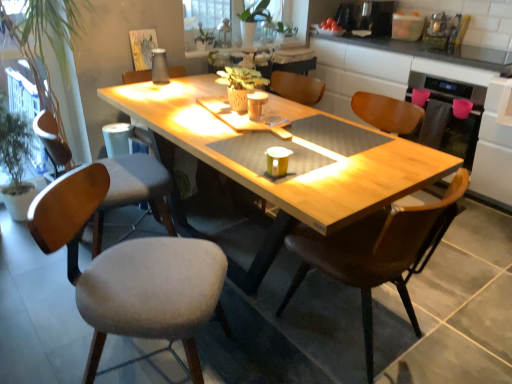
Locate an element on the screen. This screenshot has width=512, height=384. free location to the right of yellow matte coffee cup at center, which is the first coffee cup in bottom-to-top order is located at coordinates (310, 165).